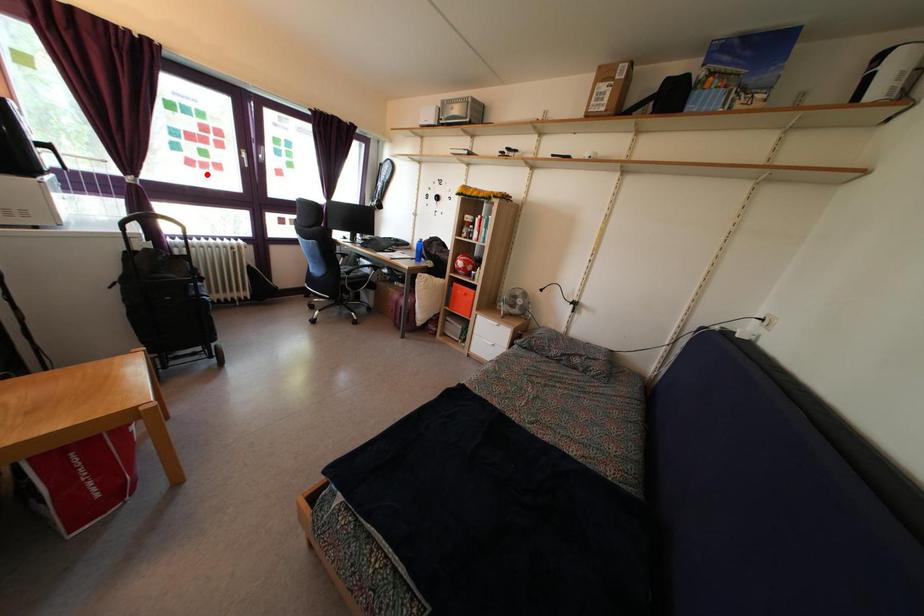
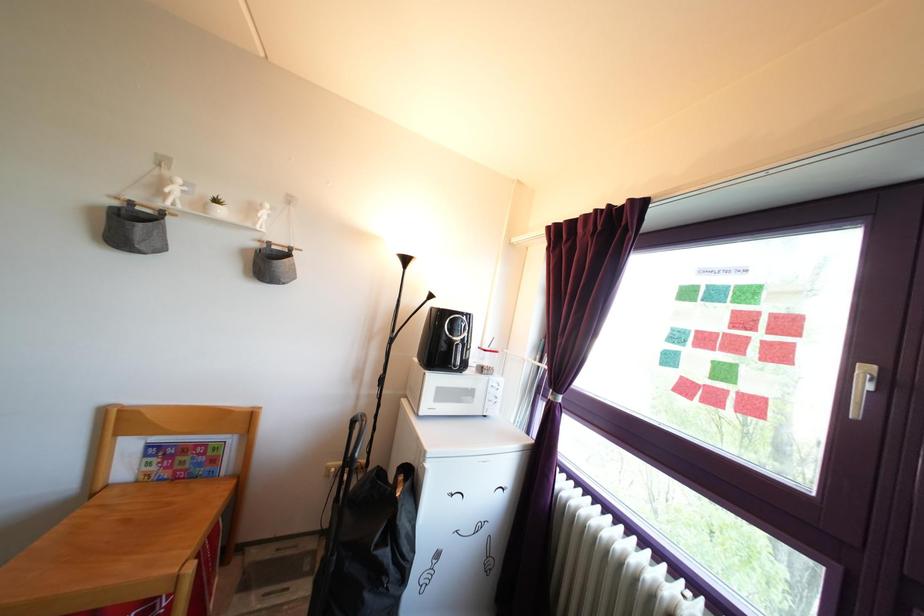
The point at the highlighted location is marked in the first image. Where is the corresponding point in the second image?

(715, 407)